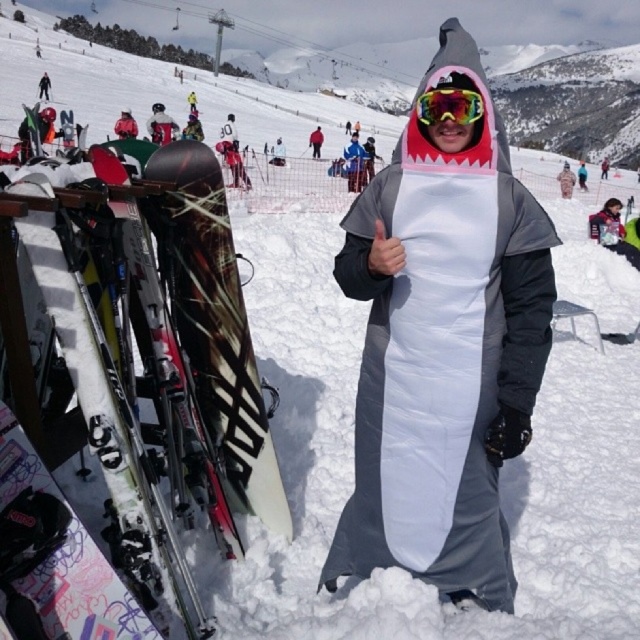
Looking at this image, is white glossy skis at left bigger than white matte snowboard at center?

Incorrect, white glossy skis at left is not larger than white matte snowboard at center.

Is the position of white glossy skis at left less distant than that of white matte snowboard at center?

That is True.

Is point (188, 573) positioned in front of point (570, 184)?

Yes, point (188, 573) is closer to viewer.

Image resolution: width=640 pixels, height=640 pixels. Identify the location of white glossy skis at left. click(83, 420).

Can you confirm if shiny black snowboard at left is positioned below matte black ski at left?

Correct, shiny black snowboard at left is located below matte black ski at left.

Who is taller, shiny black snowboard at left or matte black ski at left?

With more height is matte black ski at left.

Who is more forward, (x=212, y=186) or (x=168, y=406)?

Point (x=168, y=406)

In order to click on shiny black snowboard at left in this screenshot , I will do `click(214, 323)`.

Is matte black ski at left to the right of glossy plastic goggles at center from the viewer's perspective?

Incorrect, matte black ski at left is not on the right side of glossy plastic goggles at center.

Locate an element on the screen. Image resolution: width=640 pixels, height=640 pixels. matte black ski at left is located at coordinates (173, 369).

At what (x,y) coordinates should I click in order to perform the action: click on matte black ski at left. Please return your answer as a coordinate pair (x, y). The height and width of the screenshot is (640, 640). Looking at the image, I should click on (173, 369).